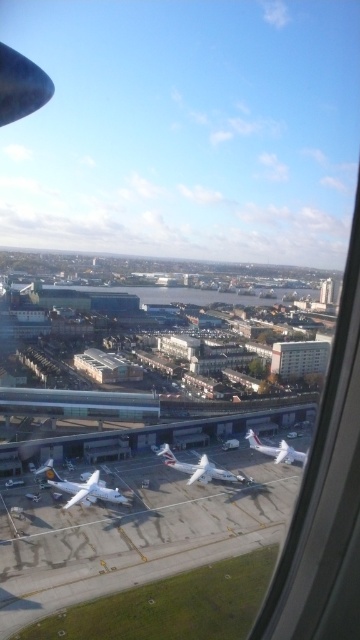
Between point (70, 500) and point (204, 483), which one is positioned in front?

Positioned in front is point (70, 500).

Consider the image. Who is more forward, [117,497] or [167,451]?

Positioned in front is point [117,497].

Where is `white matte airplane at lower left`? white matte airplane at lower left is located at coordinates (84, 488).

This screenshot has height=640, width=360. I want to click on white matte tarmac at center, so click(x=136, y=532).

Is point (34, 515) farther from viewer compared to point (95, 486)?

No, (34, 515) is in front of (95, 486).

Locate an element on the screen. This screenshot has height=640, width=360. white matte tarmac at center is located at coordinates (136, 532).

Does white matte tarmac at center have a larger size compared to white glossy airplane at center?

Correct, white matte tarmac at center is larger in size than white glossy airplane at center.

Is the position of white matte tarmac at center less distant than that of white glossy airplane at center?

Yes, white matte tarmac at center is in front of white glossy airplane at center.

Between point (127, 516) and point (221, 476), which one is positioned behind?

Point (221, 476)

Locate an element on the screen. The image size is (360, 640). white matte tarmac at center is located at coordinates (136, 532).